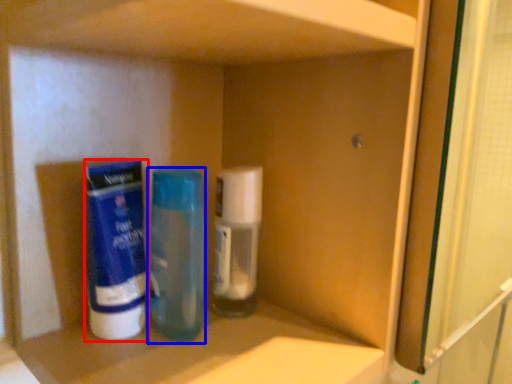
Question: Which of the following is the farthest to the observer, cleaning product (highlighted by a red box) or bottle (highlighted by a blue box)?

Choices:
 (A) cleaning product
 (B) bottle

Answer: (B)